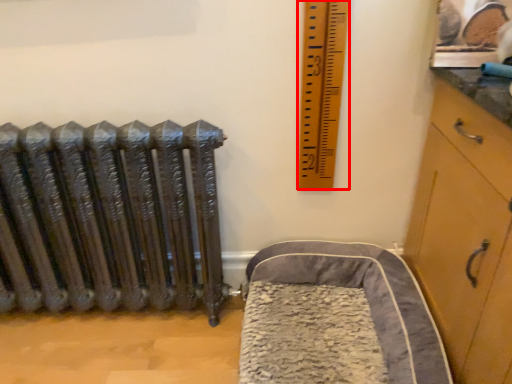
Question: In this image, where is ruler (annotated by the red box) located relative to furniture?

Choices:
 (A) right
 (B) left

Answer: (B)